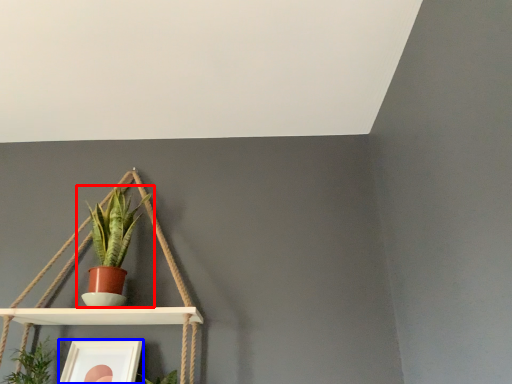
Question: Which object is closer to the camera taking this photo, houseplant (highlighted by a red box) or picture frame (highlighted by a blue box)?

Choices:
 (A) houseplant
 (B) picture frame

Answer: (B)